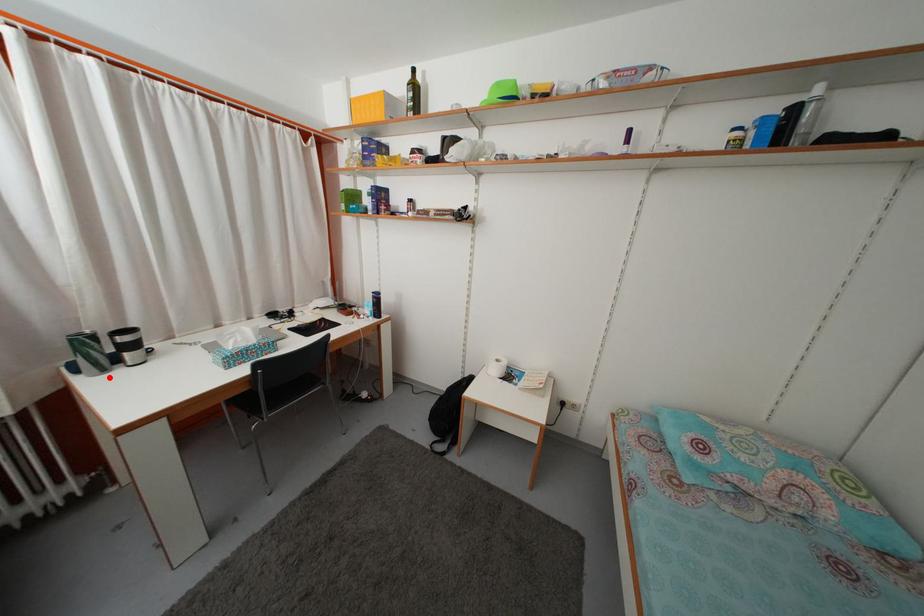
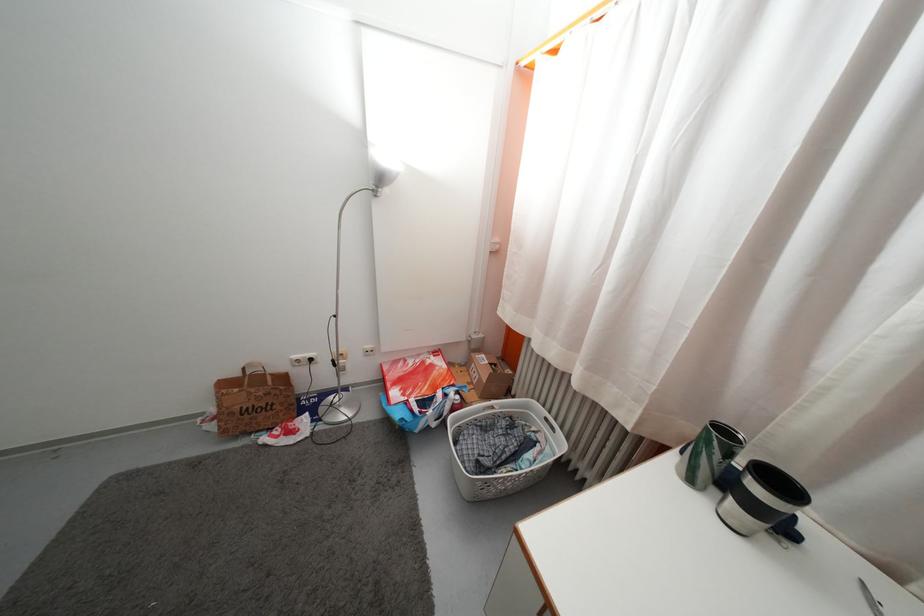
Where in the second image is the point corresponding to the highlighted location from the first image?

(697, 488)